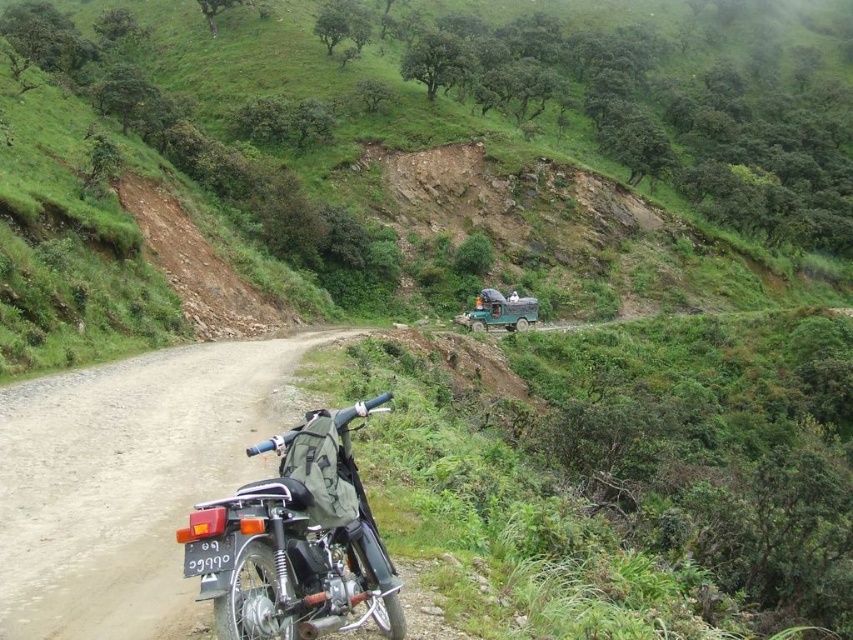
You are a hiker who wants to take a photo of the shiny black motorcycle at center and the green matte truck at center. Which object should you focus on first if you want both to be in focus?

The shiny black motorcycle at center is positioned under the green matte truck at center, so focusing on the motorcycle first would ensure both are in focus since it is closer to the camera.